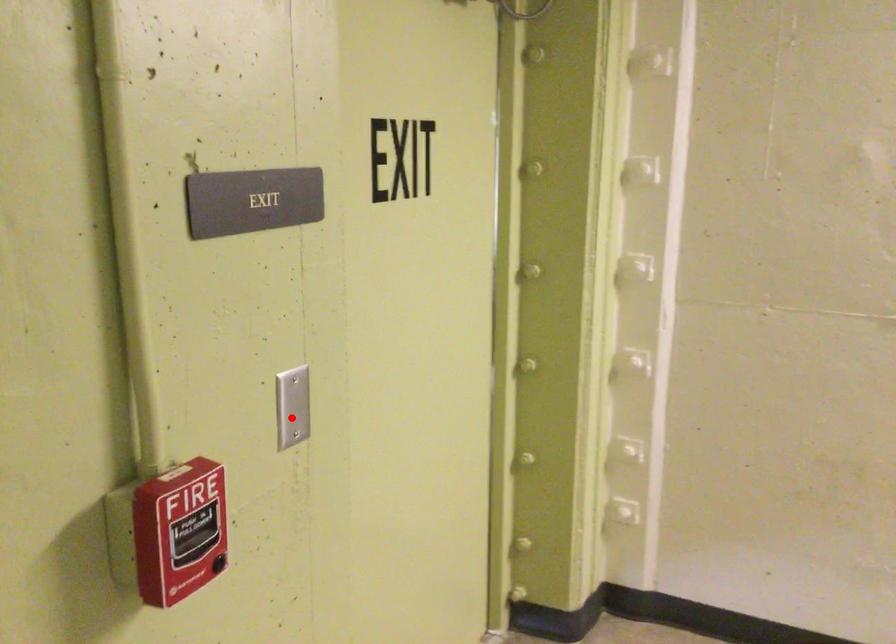
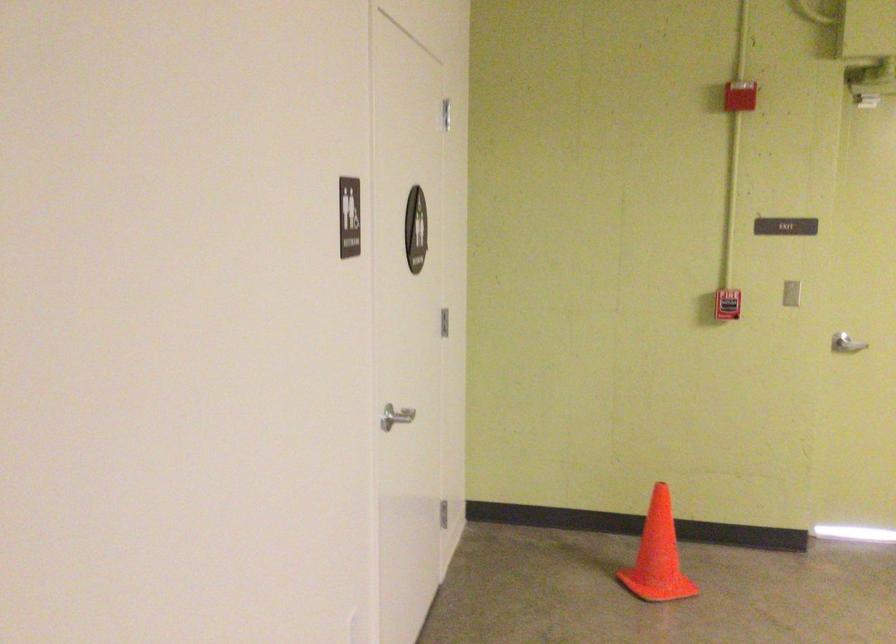
Question: I am providing you with two images of the same scene from different viewpoints. A red point is shown in image1. For the corresponding object point in image2, is it positioned nearer or farther from the camera?

Choices:
 (A) Nearer
 (B) Farther

Answer: (B)